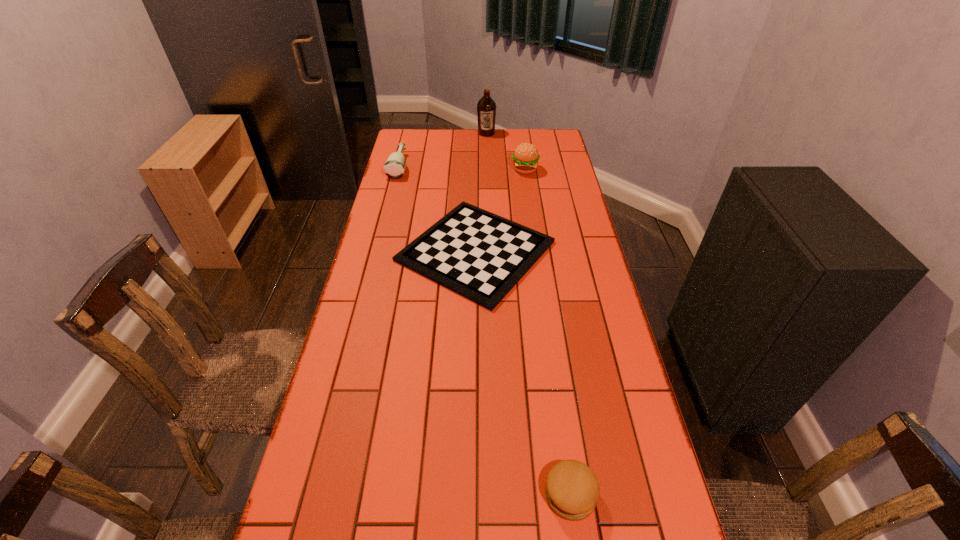
Where is `the tallest object`? The image size is (960, 540). the tallest object is located at coordinates (486, 108).

The image size is (960, 540). I want to click on olive oil, so click(x=486, y=108).

Where is `the farther hamburger`? The height and width of the screenshot is (540, 960). the farther hamburger is located at coordinates (525, 157).

Locate an element on the screen. This screenshot has height=540, width=960. the taller hamburger is located at coordinates (525, 157).

This screenshot has width=960, height=540. Find the location of `the leftmost object`. the leftmost object is located at coordinates (394, 167).

Identify the location of the fourth tallest object. (572, 490).

Locate an element on the screen. The width and height of the screenshot is (960, 540). the shorter hamburger is located at coordinates (572, 490).

Find the location of a particular element. The width and height of the screenshot is (960, 540). the second nearest object is located at coordinates (479, 255).

Locate an element on the screen. checkerboard is located at coordinates (479, 255).

The width and height of the screenshot is (960, 540). What are the coordinates of `vacant region located on the label of the olive oil` in the screenshot? It's located at (487, 154).